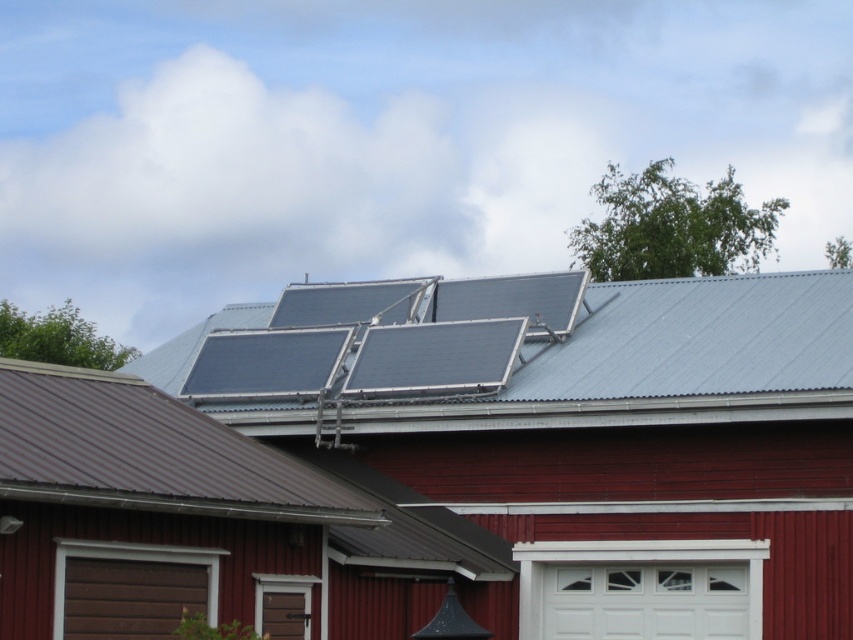
Question: Which is nearer to the white matte/glossy garage door at lower center?

Choices:
 (A) metallic red barn at center
 (B) blue metallic solar panels at center

Answer: (A)

Question: Which of the following is the closest to the observer?

Choices:
 (A) (693, 600)
 (B) (595, 285)

Answer: (A)

Question: Can you confirm if blue metallic solar panels at center is positioned to the left of white matte/glossy garage door at lower center?

Choices:
 (A) yes
 (B) no

Answer: (A)

Question: Based on their relative distances, which object is farther from the blue metallic solar panels at center?

Choices:
 (A) metallic red barn at center
 (B) white matte/glossy garage door at lower center

Answer: (B)

Question: Can you confirm if metallic red barn at center is positioned to the right of white matte/glossy garage door at lower center?

Choices:
 (A) yes
 (B) no

Answer: (B)

Question: Can you confirm if metallic red barn at center is positioned to the right of blue metallic solar panels at center?

Choices:
 (A) no
 (B) yes

Answer: (A)